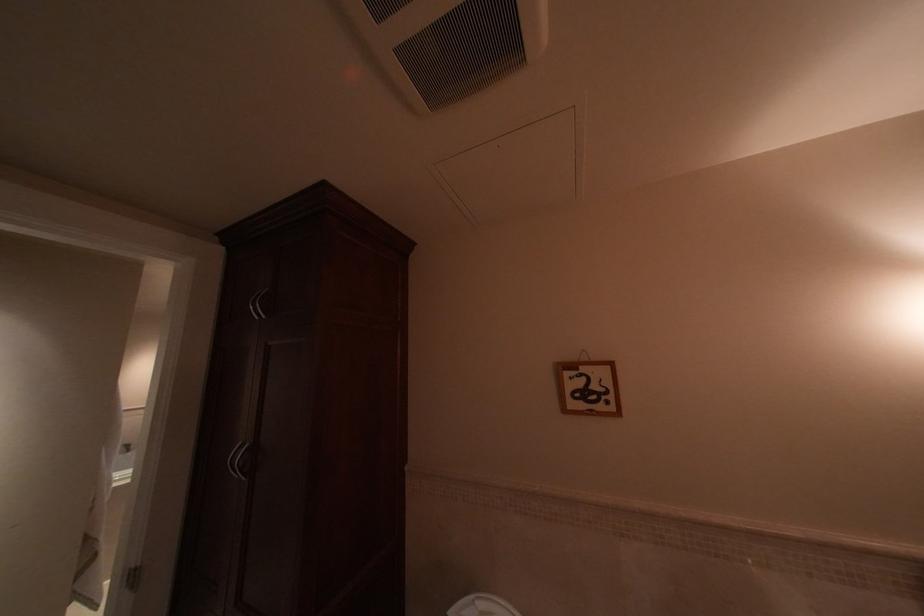
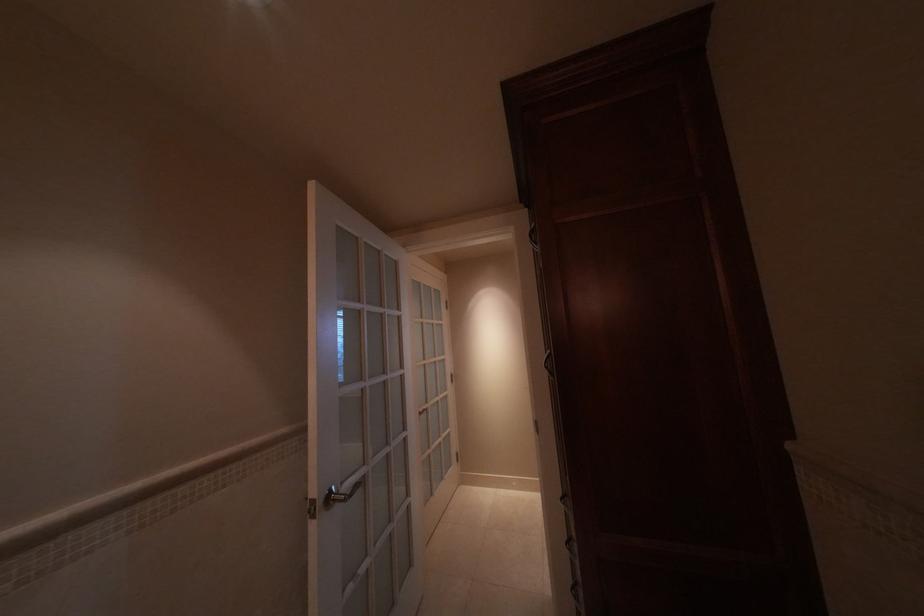
Question: The first image is from the beginning of the video and the second image is from the end. How did the camera likely rotate when shooting the video?

Choices:
 (A) Left
 (B) Right
 (C) Up
 (D) Down

Answer: (A)